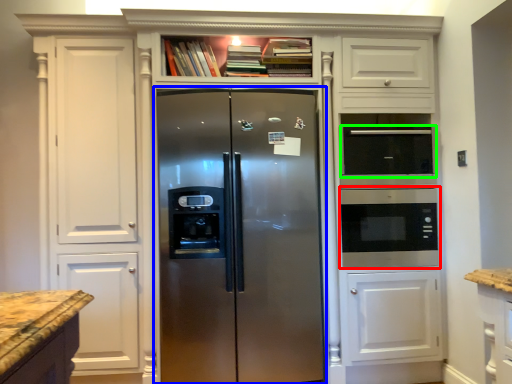
Question: Based on their relative distances, which object is farther from microwave oven (highlighted by a red box)? Choose from refrigerator (highlighted by a blue box) and appliance (highlighted by a green box).

Choices:
 (A) refrigerator
 (B) appliance

Answer: (A)